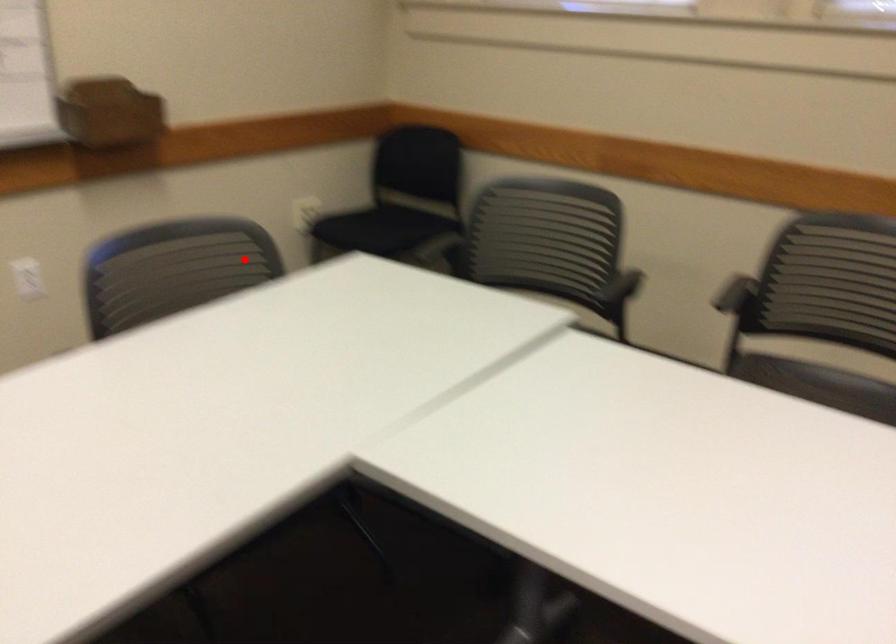
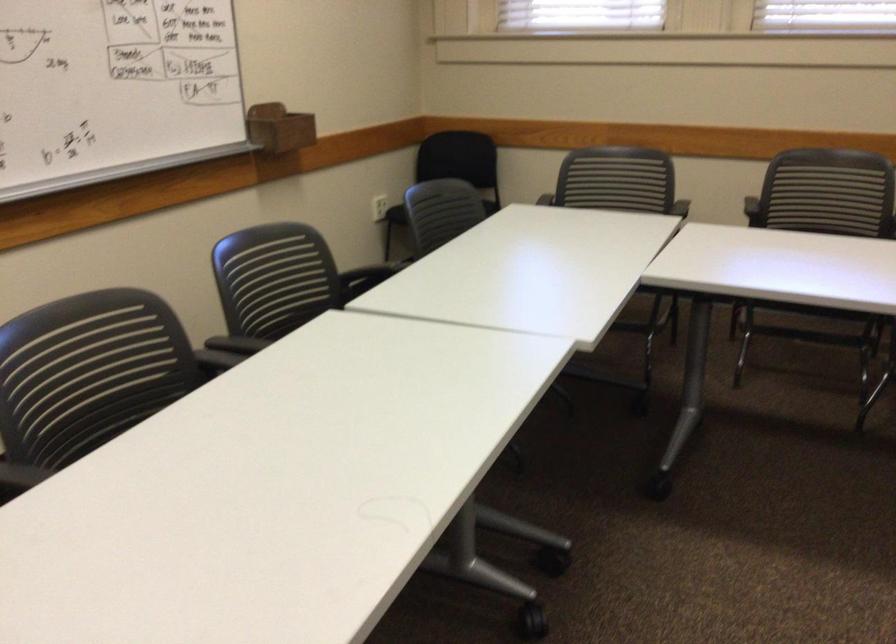
The point at the highlighted location is marked in the first image. Where is the corresponding point in the second image?

(441, 212)